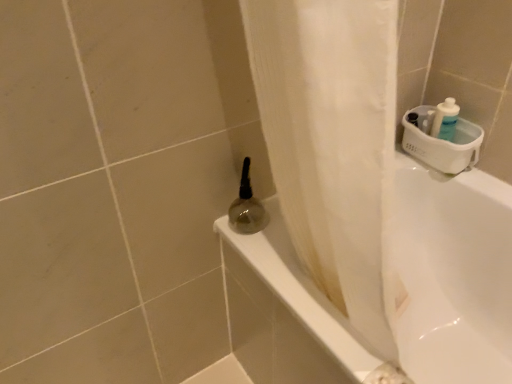
Locate an element on the screen. free space in front of translucent glass bottle at upper center is located at coordinates (270, 267).